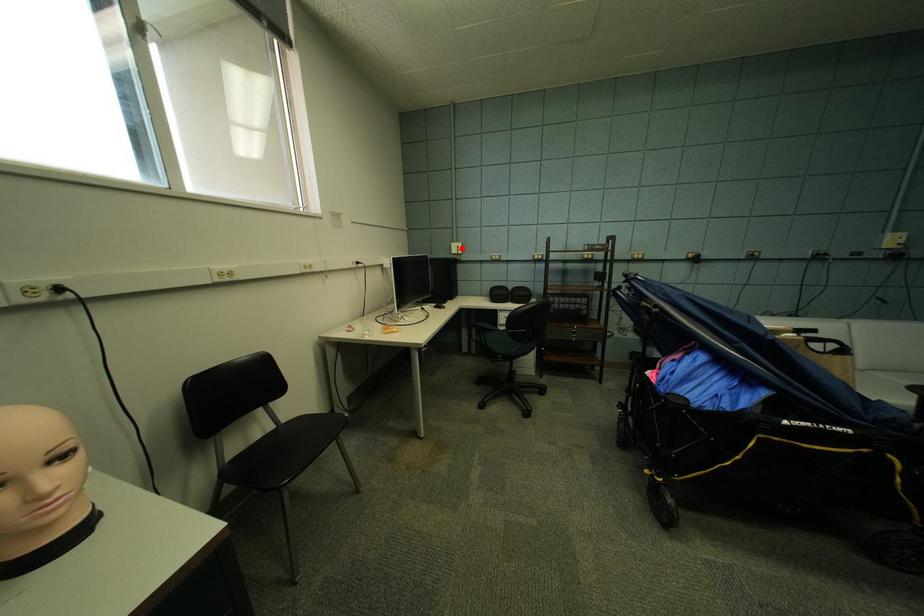
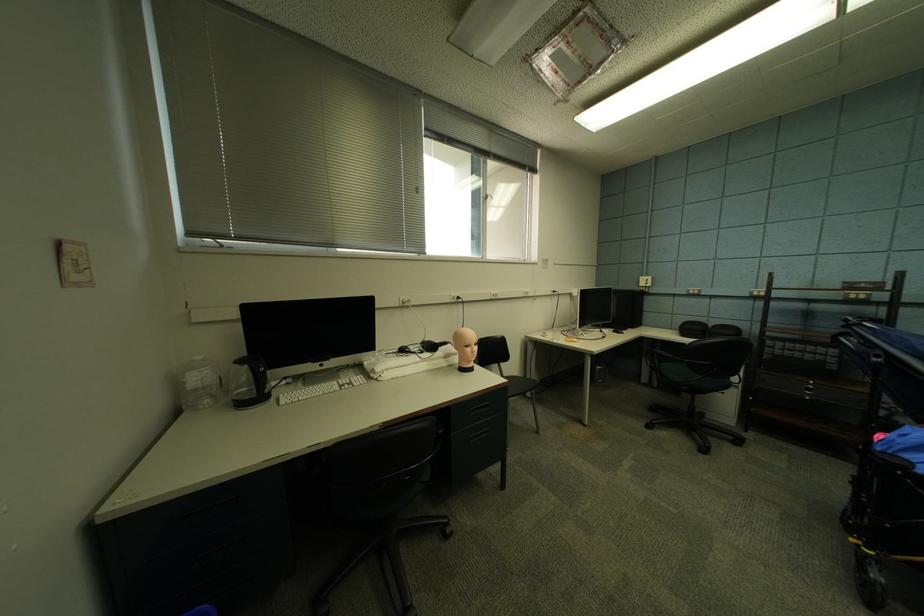
Where in the second image is the point corresponding to the highlighted location from the first image?

(650, 282)